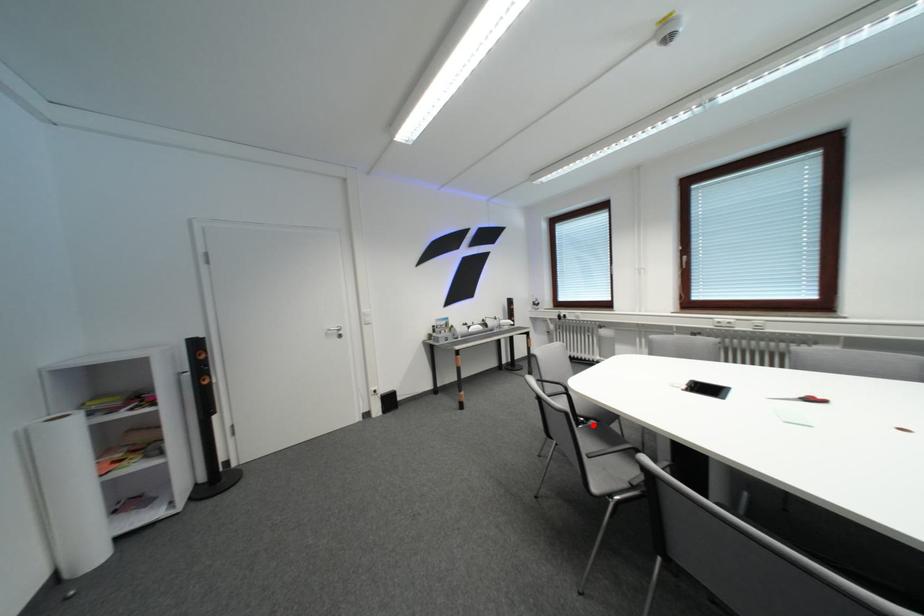
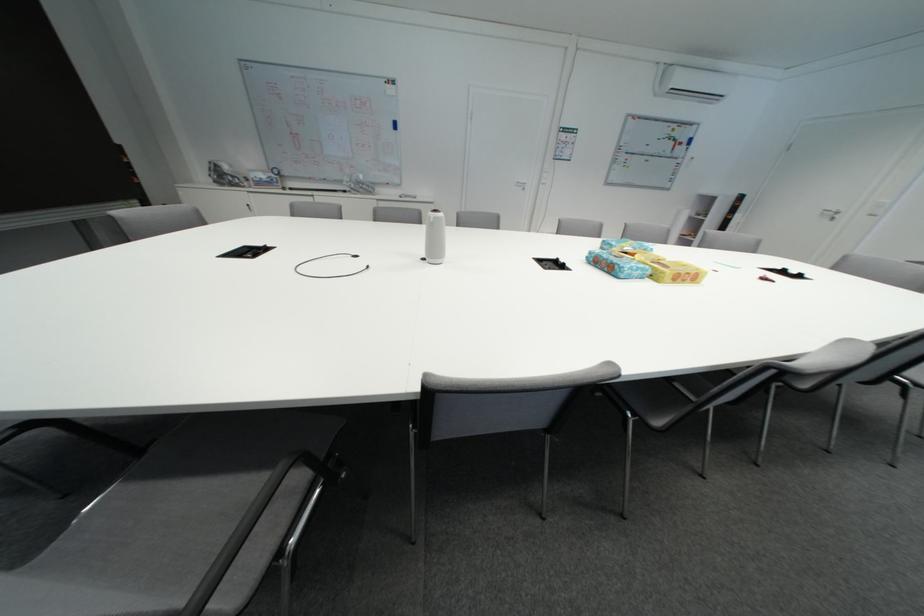
Question: I am providing you with two images of the same scene from different viewpoints. A red point is marked on the first image. At the location where the point appears in image 1, is it still visible in image 2?

Choices:
 (A) Yes
 (B) No

Answer: (B)